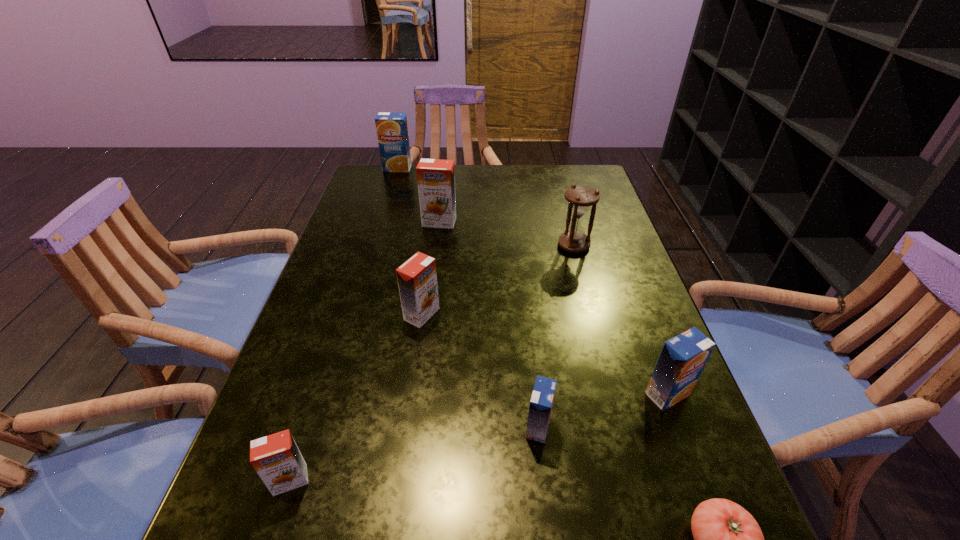
Where is `blue orange_juice that stands as the closest to the fifth object from left to right`? The image size is (960, 540). blue orange_juice that stands as the closest to the fifth object from left to right is located at coordinates (683, 358).

Locate which blue orange_juice ranks second in proximity to the seventh nearest object. Please provide its 2D coordinates. Your answer should be formatted as a tuple, i.e. [(x, y)], where the tuple contains the x and y coordinates of a point satisfying the conditions above.

[(541, 403)]

Point out which orange orange juice is positioned as the second nearest to the sixth object from left to right. Please provide its 2D coordinates. Your answer should be formatted as a tuple, i.e. [(x, y)], where the tuple contains the x and y coordinates of a point satisfying the conditions above.

[(417, 278)]

At what (x,y) coordinates should I click in order to perform the action: click on orange orange juice that is the nearest to the hourglass. Please return your answer as a coordinate pair (x, y). The width and height of the screenshot is (960, 540). Looking at the image, I should click on (436, 181).

At what (x,y) coordinates should I click in order to perform the action: click on vacant region that satisfies the following two spatial constraints: 1. on the front side of the fourth farthest orange juice; 2. on the right side of the third object from right to left. Please return your answer as a coordinate pair (x, y). Looking at the image, I should click on (613, 394).